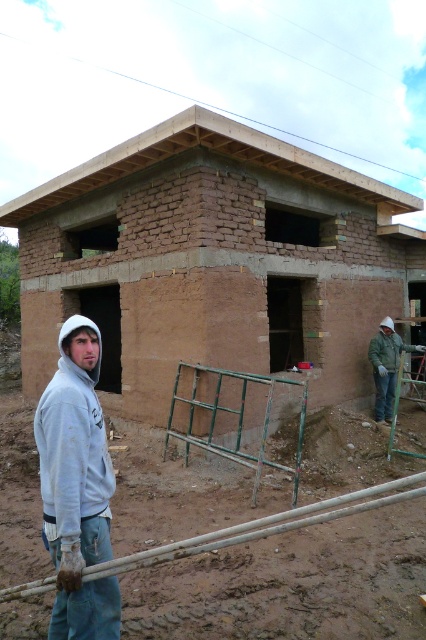
Question: Which object appears closest to the camera in this image?

Choices:
 (A) brown mud hut at center
 (B) gray hoodie at left
 (C) white matte construction worker at right

Answer: (B)

Question: From the image, what is the correct spatial relationship of brown mud hut at center in relation to gray hoodie at left?

Choices:
 (A) right
 (B) left

Answer: (B)

Question: Is brown mud hut at center bigger than white matte construction worker at right?

Choices:
 (A) no
 (B) yes

Answer: (B)

Question: Which of the following is the closest to the observer?

Choices:
 (A) (66, 566)
 (B) (425, 346)

Answer: (A)

Question: Which point is closer to the camera?

Choices:
 (A) (97, 624)
 (B) (412, 344)
 (C) (149, 244)

Answer: (A)

Question: From the image, what is the correct spatial relationship of brown mud hut at center in relation to gray hoodie at left?

Choices:
 (A) below
 (B) above

Answer: (B)